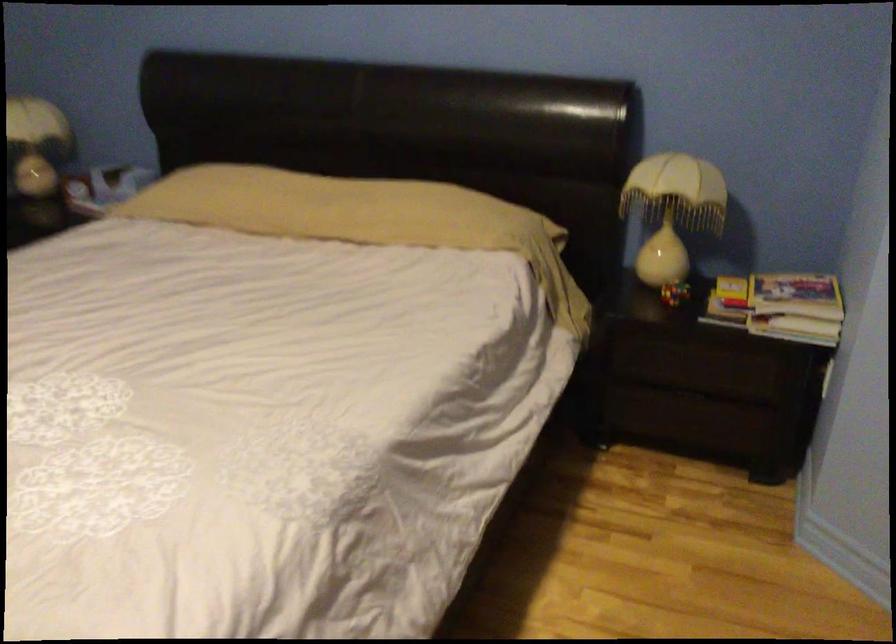
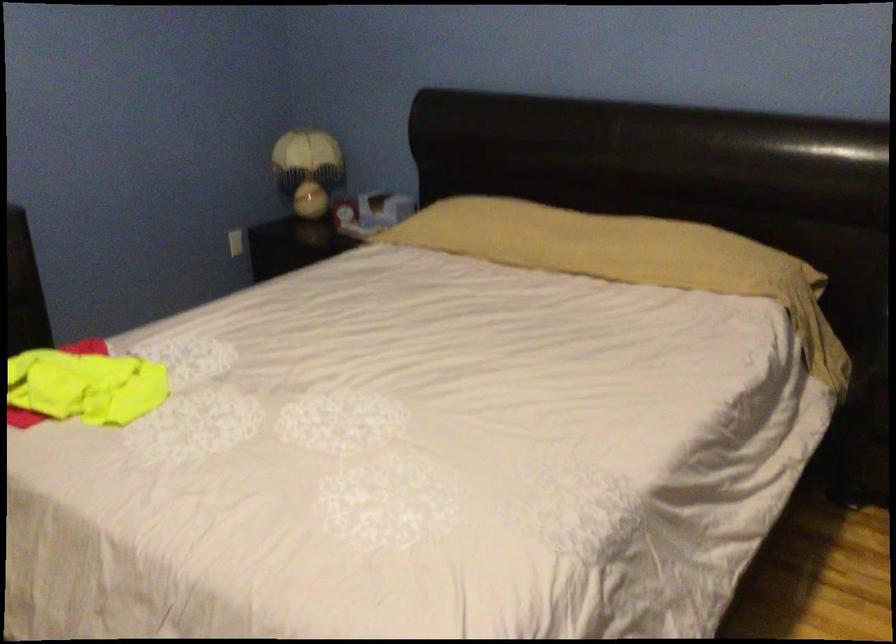
Question: The camera is either moving clockwise (left) or counter-clockwise (right) around the object. The first image is from the beginning of the video and the second image is from the end. Is the camera moving left or right when shooting the video?

Choices:
 (A) Left
 (B) Right

Answer: (B)